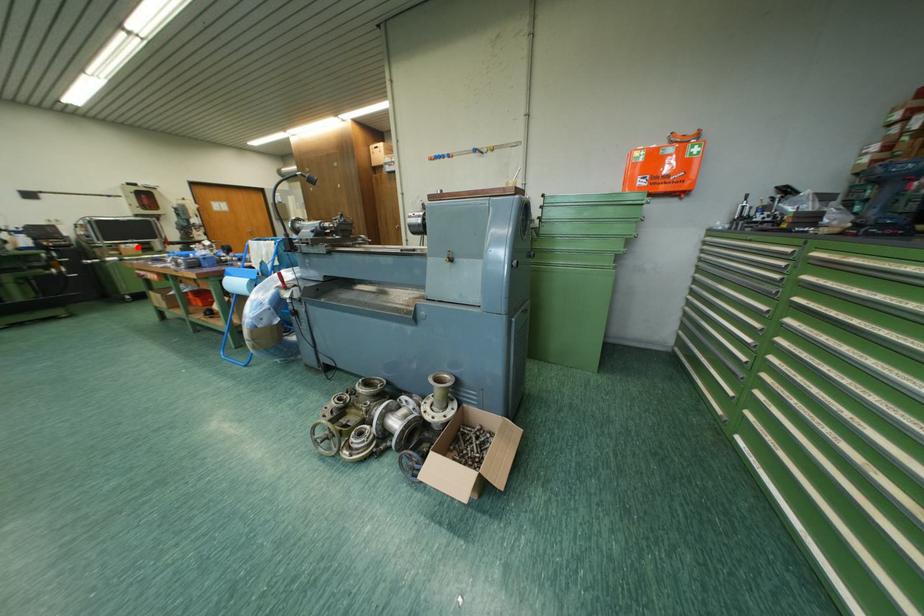
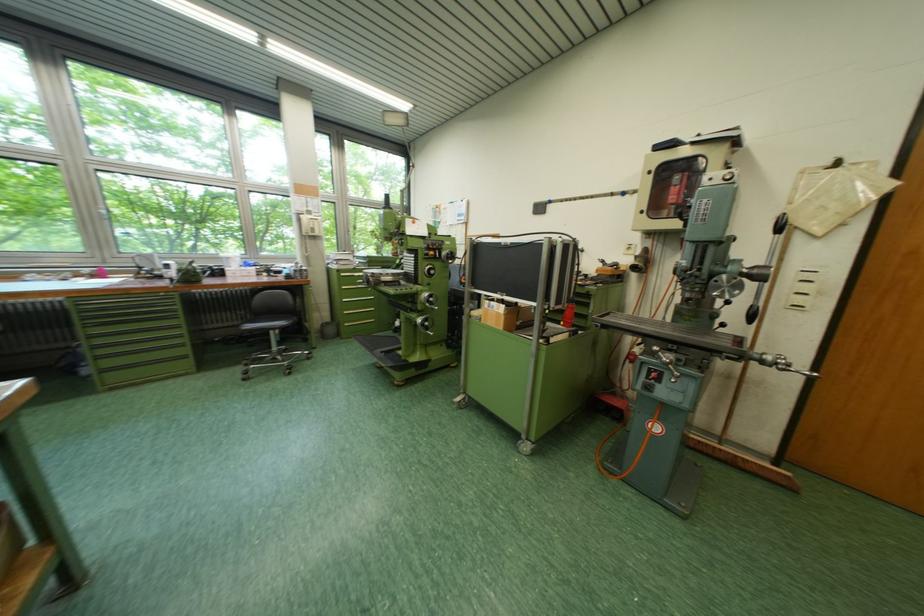
Locate, in the second image, the point that corresponds to the highlighted location in the first image.

(503, 305)